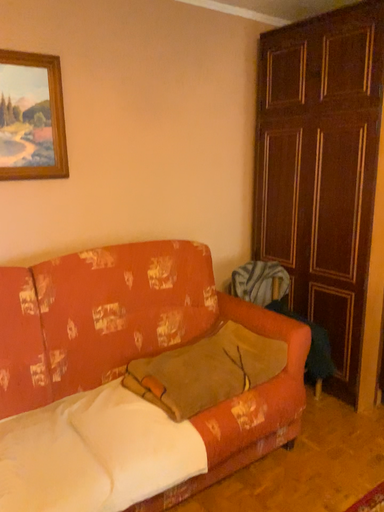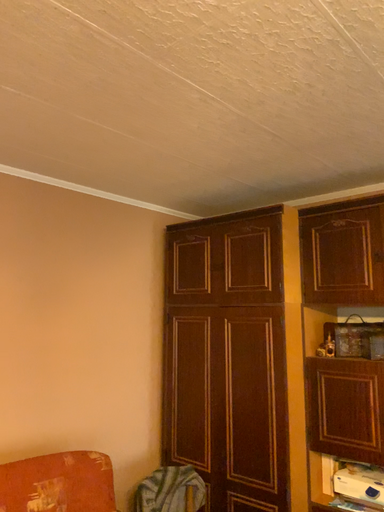
Question: How did the camera likely rotate when shooting the video?

Choices:
 (A) rotated right
 (B) rotated left

Answer: (A)